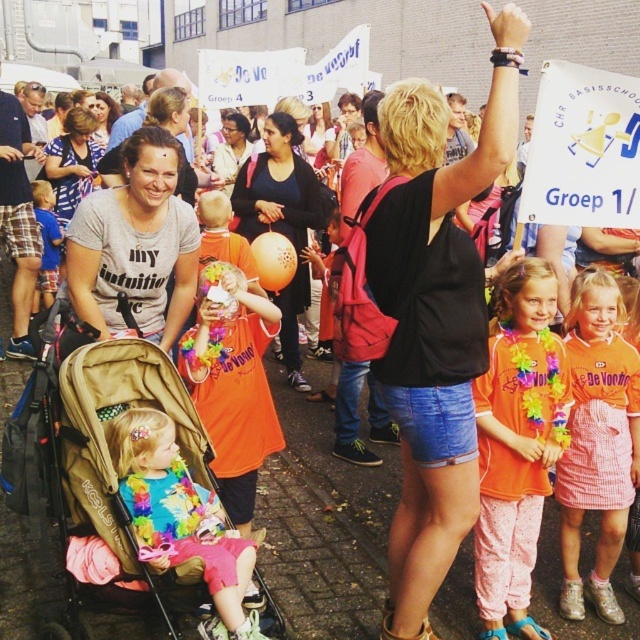
Can you confirm if matte gray t-shirt at center is thinner than matte pink pants at lower left?

Indeed, matte gray t-shirt at center has a lesser width compared to matte pink pants at lower left.

Can you confirm if matte gray t-shirt at center is positioned above matte pink pants at lower left?

Indeed, matte gray t-shirt at center is positioned over matte pink pants at lower left.

Does point (106, 314) lie behind point (134, 444)?

Yes, point (106, 314) is farther from viewer.

Locate an element on the screen. matte gray t-shirt at center is located at coordinates (134, 244).

Is orange fabric lei at center closer to the viewer compared to matte gray t-shirt at center?

No, it is not.

Based on the photo, is orange fabric lei at center bigger than matte gray t-shirt at center?

Actually, orange fabric lei at center might be smaller than matte gray t-shirt at center.

Find the location of a particular element. The width and height of the screenshot is (640, 640). orange fabric lei at center is located at coordinates (516, 444).

The image size is (640, 640). What are the coordinates of `orange fabric lei at center` in the screenshot? It's located at (516, 444).

In the scene shown: Who is more forward, (16, 465) or (598, 428)?

Positioned in front is point (16, 465).

Can you confirm if beige fabric baby carriage at lower left is wider than pink checkered skirt at center?

Correct, the width of beige fabric baby carriage at lower left exceeds that of pink checkered skirt at center.

Does point (236, 560) come closer to viewer compared to point (618, 605)?

Yes, it is.

Identify the location of beige fabric baby carriage at lower left. This screenshot has height=640, width=640. (x=112, y=477).